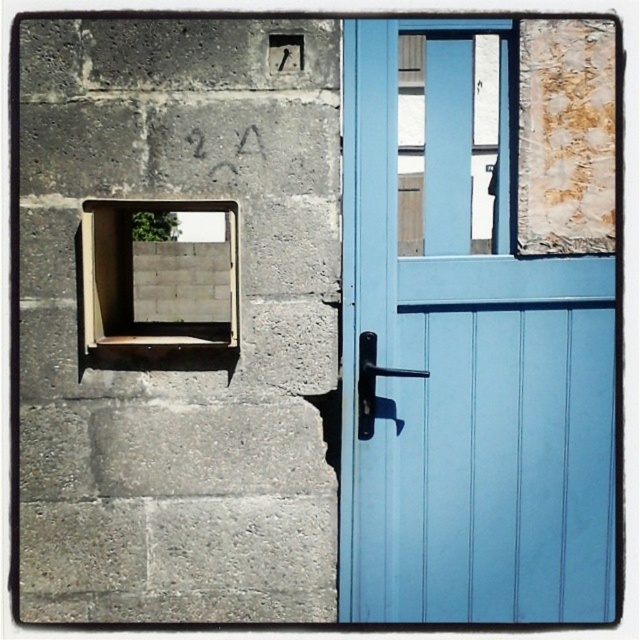
Question: Which object is closer to the camera taking this photo?

Choices:
 (A) matte glass window at left
 (B) light blue wooden door at center

Answer: (A)

Question: Is light blue wooden door at center further to the viewer compared to polished metal door handle at center?

Choices:
 (A) no
 (B) yes

Answer: (A)

Question: Which point is farther to the camera?

Choices:
 (A) (374, 340)
 (B) (106, 246)
 (C) (385, 148)

Answer: (B)

Question: Observing the image, what is the correct spatial positioning of light blue wooden door at center in reference to matte glass window at left?

Choices:
 (A) left
 (B) right

Answer: (B)

Question: Can you confirm if light blue wooden door at center is thinner than matte glass window at left?

Choices:
 (A) yes
 (B) no

Answer: (B)

Question: Which of the following is the closest to the observer?

Choices:
 (A) matte glass window at left
 (B) polished metal door handle at center

Answer: (A)